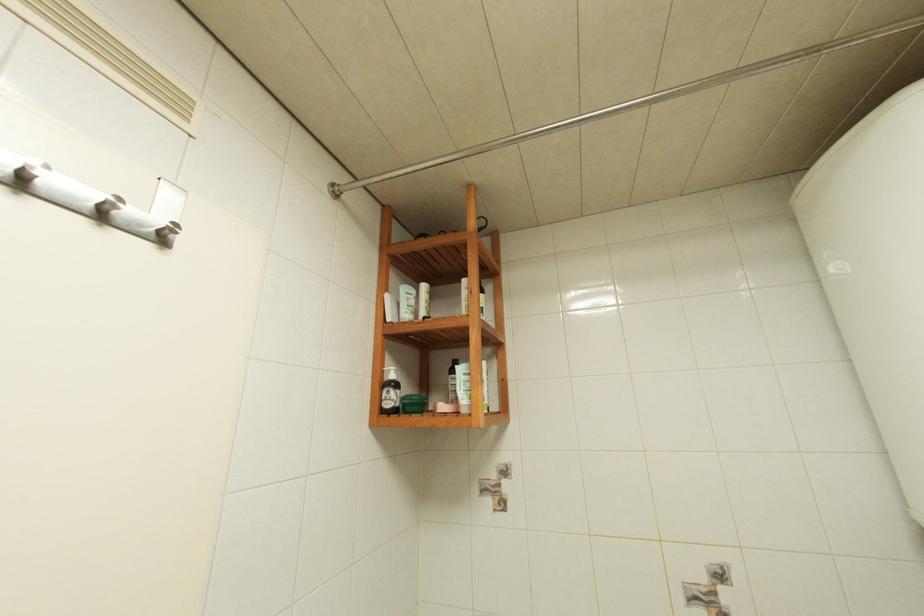
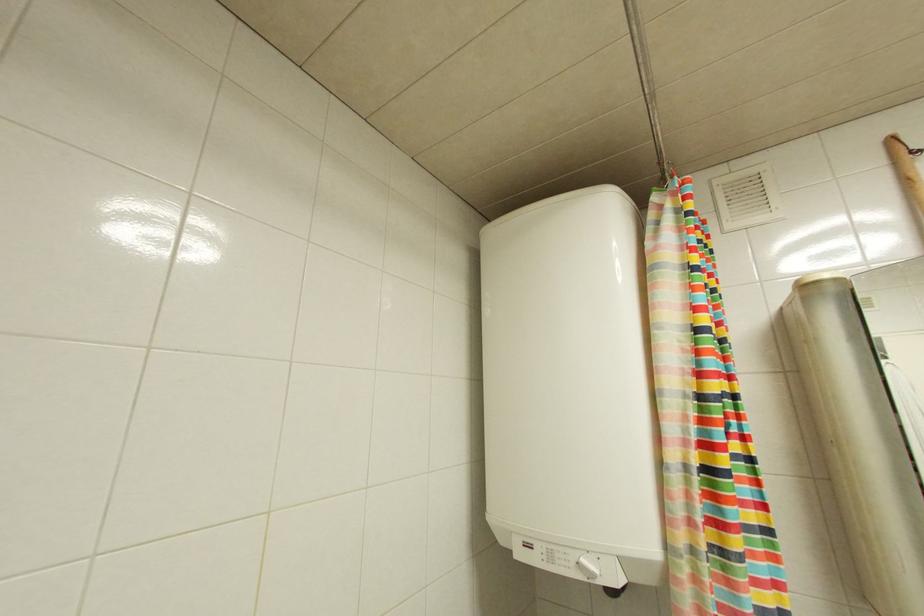
Question: The camera is either moving clockwise (left) or counter-clockwise (right) around the object. The first image is from the beginning of the video and the second image is from the end. Is the camera moving left or right when shooting the video?

Choices:
 (A) Left
 (B) Right

Answer: (A)